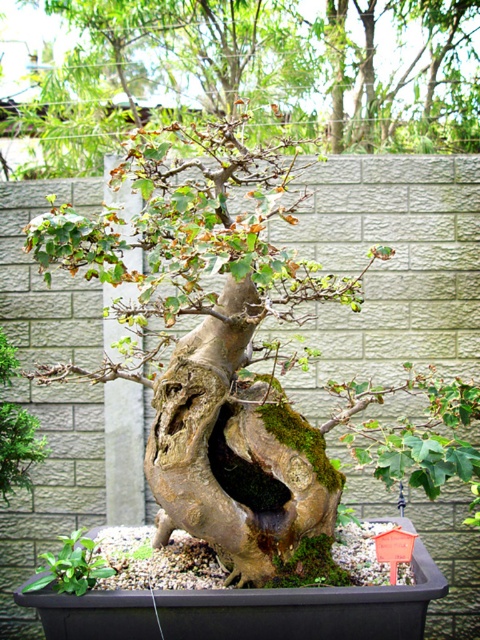
Consider the image. Who is more forward, (x=163, y=96) or (x=103, y=557)?

Point (x=103, y=557) is more forward.

Between point (377, 32) and point (100, 572), which one is positioned behind?

Positioned behind is point (377, 32).

Measure the distance between point (303, 58) and camera.

Point (303, 58) and camera are 3.72 meters apart.

Where is `green mossy tree trunk at center`? This screenshot has height=640, width=480. green mossy tree trunk at center is located at coordinates (242, 74).